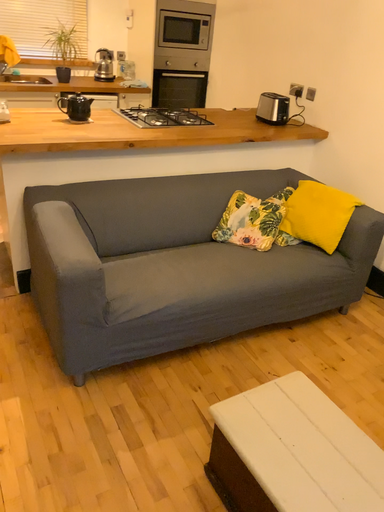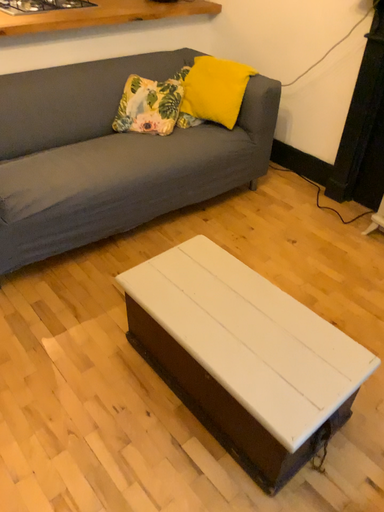
Question: How did the camera likely rotate when shooting the video?

Choices:
 (A) rotated downward
 (B) rotated upward

Answer: (A)